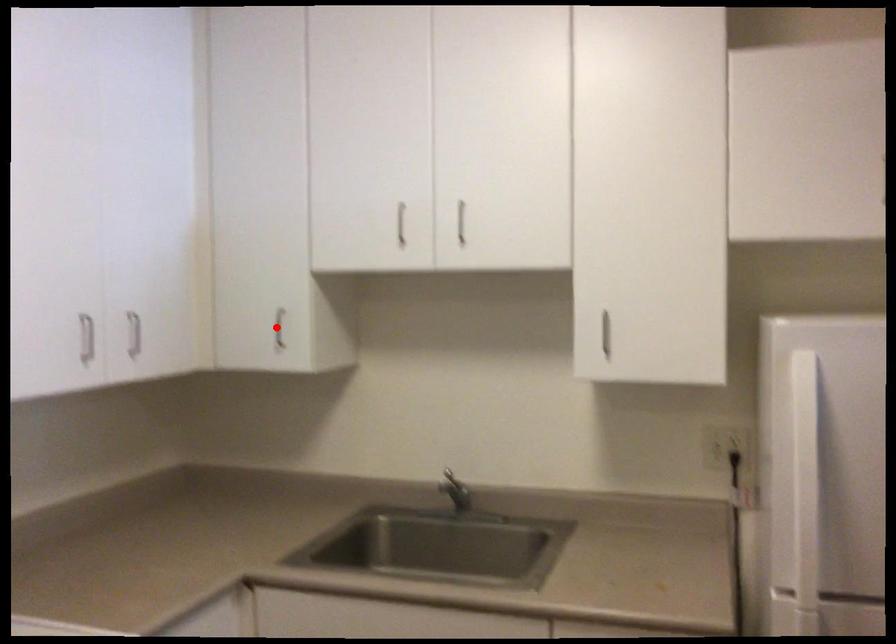
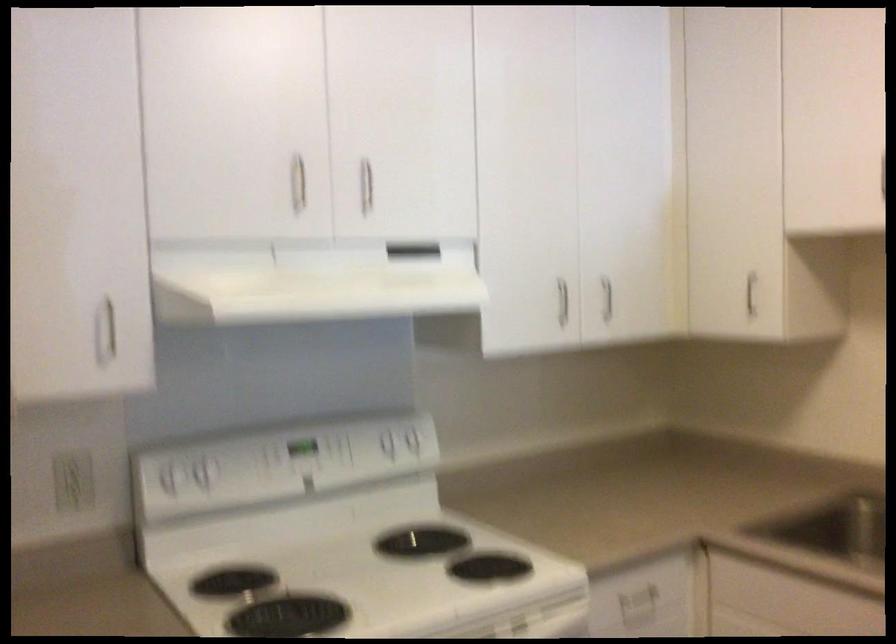
The point at the highlighted location is marked in the first image. Where is the corresponding point in the second image?

(751, 292)